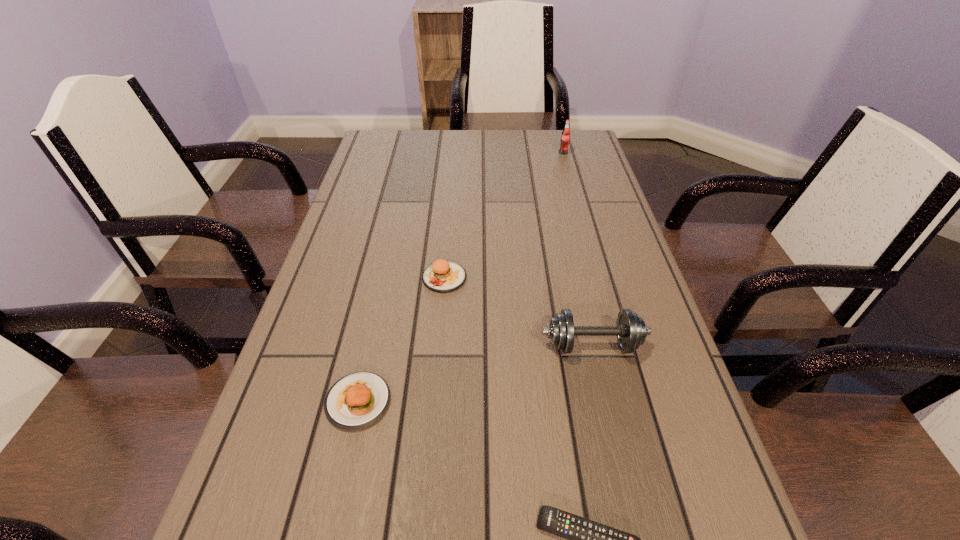
At what (x,y) coordinates should I click in order to perform the action: click on free area in between the third nearest object and the nearer food. Please return your answer as a coordinate pair (x, y). This screenshot has width=960, height=540. Looking at the image, I should click on (475, 373).

Identify the location of empty space between the leftmost object and the second tallest object. The height and width of the screenshot is (540, 960). (475, 373).

Where is `vacant region between the shorter food and the second tallest object`? Image resolution: width=960 pixels, height=540 pixels. vacant region between the shorter food and the second tallest object is located at coordinates (475, 373).

The height and width of the screenshot is (540, 960). Identify the location of vacant space that's between the second tallest object and the fourth nearest object. (518, 311).

Identify the location of vacant space that is in between the fourth nearest object and the soda bottle. This screenshot has width=960, height=540. (504, 215).

Identify which object is located as the third nearest to the farthest object. Please provide its 2D coordinates. Your answer should be formatted as a tuple, i.e. [(x, y)], where the tuple contains the x and y coordinates of a point satisfying the conditions above.

[(357, 400)]

At what (x,y) coordinates should I click in order to perform the action: click on object that is the nearest to the taller food. Please return your answer as a coordinate pair (x, y). The height and width of the screenshot is (540, 960). Looking at the image, I should click on (631, 331).